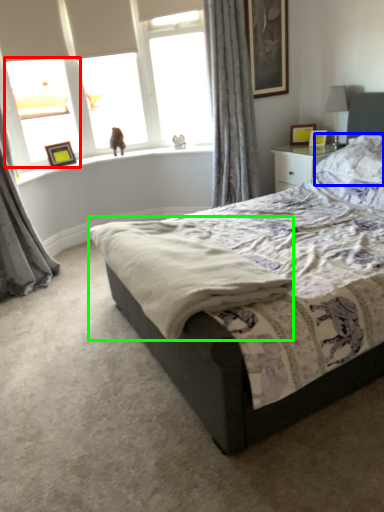
Question: Which is farther away from window (highlighted by a red box)? pillow (highlighted by a blue box) or cloth (highlighted by a green box)?

Choices:
 (A) pillow
 (B) cloth

Answer: (A)